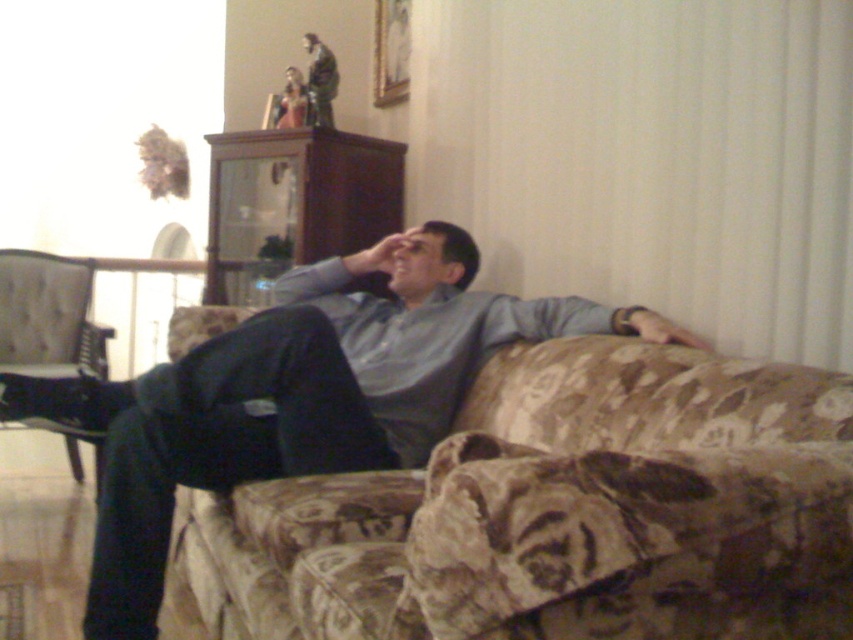
Question: Considering the relative positions of matte gray shirt at center and tufted fabric chair at lower left in the image provided, where is matte gray shirt at center located with respect to tufted fabric chair at lower left?

Choices:
 (A) below
 (B) above

Answer: (A)

Question: Does matte gray shirt at center have a larger size compared to tufted fabric chair at lower left?

Choices:
 (A) yes
 (B) no

Answer: (A)

Question: Is matte gray shirt at center further to the viewer compared to tufted fabric chair at lower left?

Choices:
 (A) no
 (B) yes

Answer: (A)